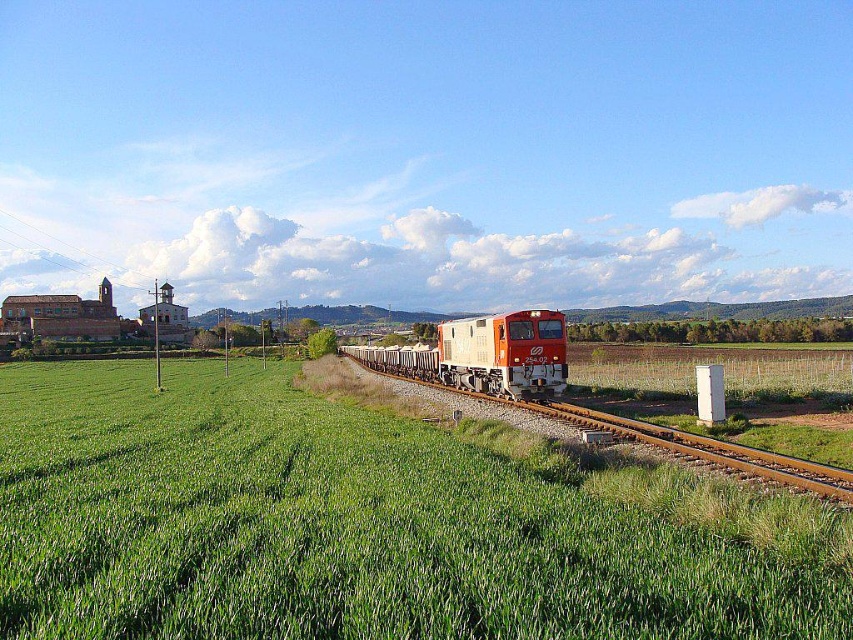
You are standing at the center of the image. Which direction should you walk to reach the green grass at center?

The green grass at center is located at point coordinates of (373, 522). Since you are already at the center, you are already standing on the green grass at center.

You are standing at the point labeled point [421,364] and want to walk to the point labeled point [822,618]. Which direction should you face to walk towards your destination?

You should face away from the camera because point [822,618] is closer to the camera than point [421,364].